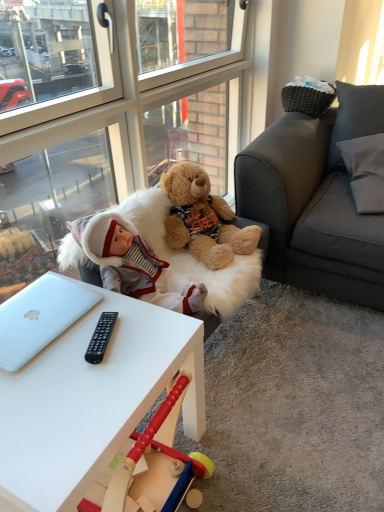
Question: Looking at their shapes, would you say transparent glass door at upper left is wider or thinner than fluffy brown teddy bear at center?

Choices:
 (A) wide
 (B) thin

Answer: (B)

Question: Does point (34, 175) appear closer or farther from the camera than point (251, 227)?

Choices:
 (A) closer
 (B) farther

Answer: (B)

Question: Estimate the real-world distances between objects in this image. Which object is farther from the fluffy brown teddy bear at center?

Choices:
 (A) white fur swivel chair at center
 (B) transparent glass door at upper left
 (C) white matte desk at center
 (D) silver metallic laptop at lower left
 (E) white fabric pillow at upper right

Answer: (C)

Question: Estimate the real-world distances between objects in this image. Which object is farther from the silver metallic laptop at lower left?

Choices:
 (A) fluffy brown teddy bear at center
 (B) white fabric pillow at upper right
 (C) white matte desk at center
 (D) white fur swivel chair at center
 (E) transparent glass door at upper left

Answer: (B)